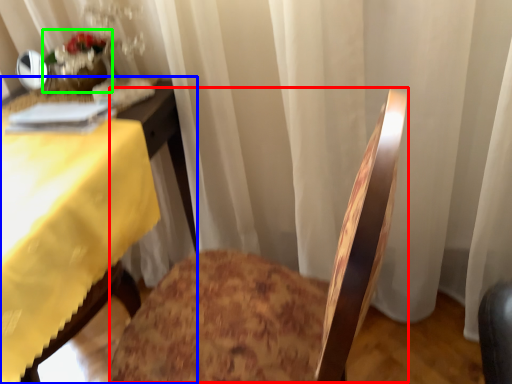
Question: Based on their relative distances, which object is farther from rocking chair (highlighted by a red box)? Choose from table (highlighted by a blue box) and floral arrangement (highlighted by a green box).

Choices:
 (A) table
 (B) floral arrangement

Answer: (B)